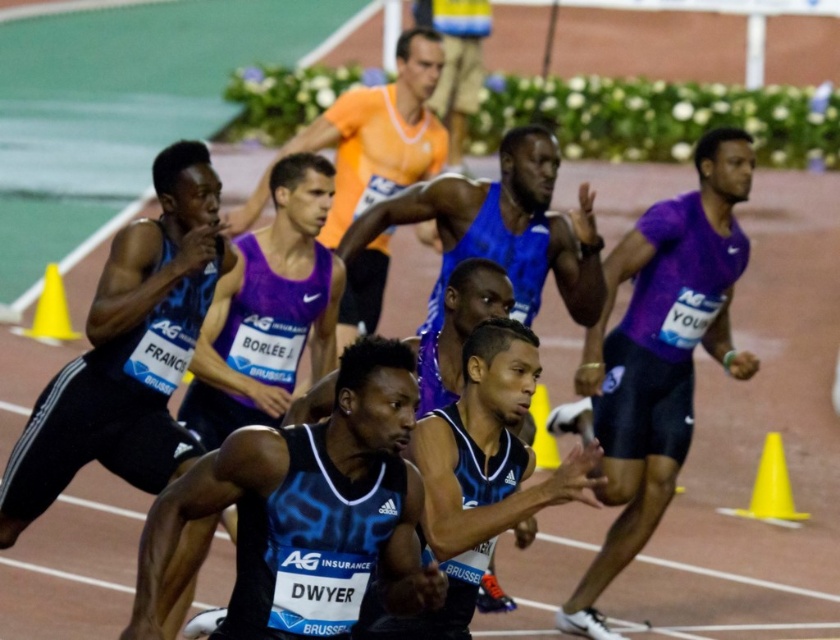
Question: Can you confirm if black matte tank top at center is bigger than yellow plastic cone at right?

Choices:
 (A) yes
 (B) no

Answer: (A)

Question: Which point is closer to the camera?

Choices:
 (A) matte blue singlet at center
 (B) yellow plastic cone at right
 (C) black matte tank top at center

Answer: (C)

Question: Which object is positioned closest to the yellow plastic cone at right?

Choices:
 (A) orange matte shirt at upper center
 (B) black matte tank top at center
 (C) yellow plastic cone at left

Answer: (A)

Question: Does black matte tank top at center have a greater width compared to yellow plastic cone at right?

Choices:
 (A) yes
 (B) no

Answer: (A)

Question: Which object appears farthest from the camera in this image?

Choices:
 (A) yellow plastic cone at right
 (B) purple matte shirt at right
 (C) orange matte shirt at upper center

Answer: (A)

Question: Does black matte tank top at center appear over orange matte shirt at upper center?

Choices:
 (A) no
 (B) yes

Answer: (A)